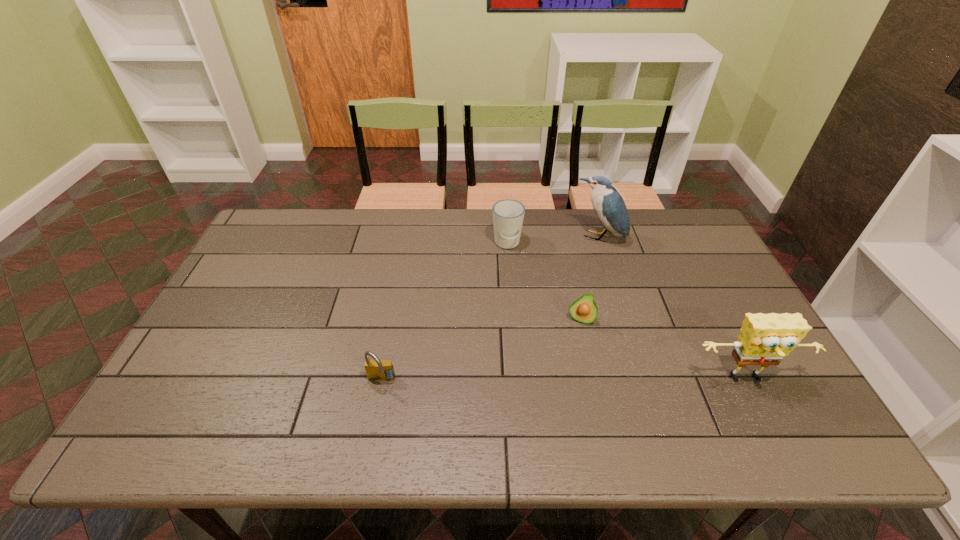
Find the location of a particular element. object located in the near right corner section of the desktop is located at coordinates (764, 339).

The height and width of the screenshot is (540, 960). Find the location of `vacant space at the far edge of the desktop`. vacant space at the far edge of the desktop is located at coordinates (484, 232).

In order to click on vacant region at the near edge of the desktop in this screenshot , I will do `click(591, 380)`.

The image size is (960, 540). Identify the location of blank space at the left edge of the desktop. (266, 284).

This screenshot has width=960, height=540. In the image, there is a desktop. Identify the location of vacant space at the far left corner. (271, 243).

At what (x,y) coordinates should I click in order to perform the action: click on free space at the far right corner. Please return your answer as a coordinate pair (x, y). The height and width of the screenshot is (540, 960). Looking at the image, I should click on click(x=645, y=209).

The width and height of the screenshot is (960, 540). I want to click on vacant space in between the rightmost object and the second object from left to right, so click(627, 312).

This screenshot has height=540, width=960. What are the coordinates of `free space between the avocado and the padlock` in the screenshot? It's located at (481, 350).

Where is `vacant area that lies between the bird and the sponge`? The width and height of the screenshot is (960, 540). vacant area that lies between the bird and the sponge is located at coordinates (673, 309).

What are the coordinates of `free space between the third nearest object and the leftmost object` in the screenshot? It's located at (481, 350).